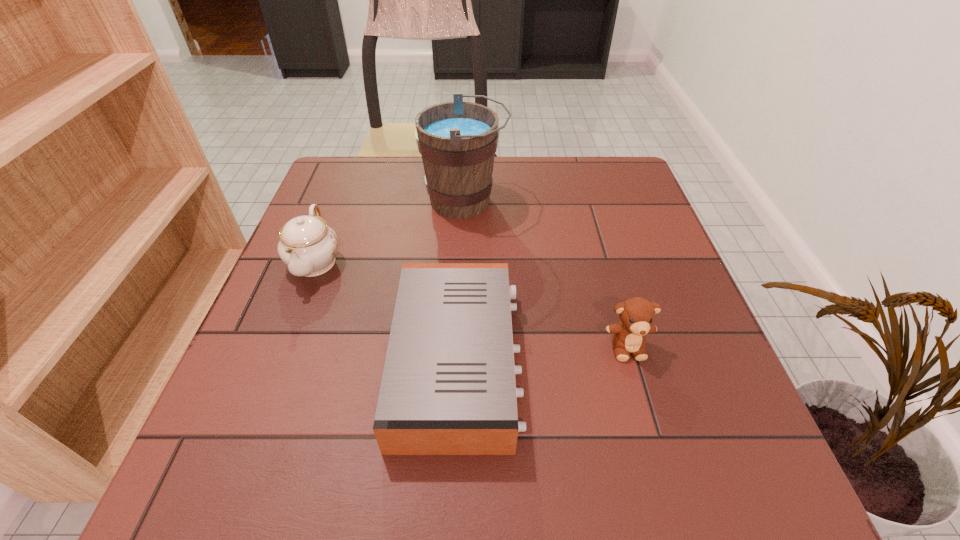
Find the location of a particular element. blank space that satisfies the following two spatial constraints: 1. with a handle on the side of the wine bucket; 2. at the spout of the third nearest object is located at coordinates (463, 261).

The height and width of the screenshot is (540, 960). What are the coordinates of `free spot that satisfies the following two spatial constraints: 1. on the face of the rightmost object; 2. on the control panel of the radio receiver` in the screenshot? It's located at coord(632,361).